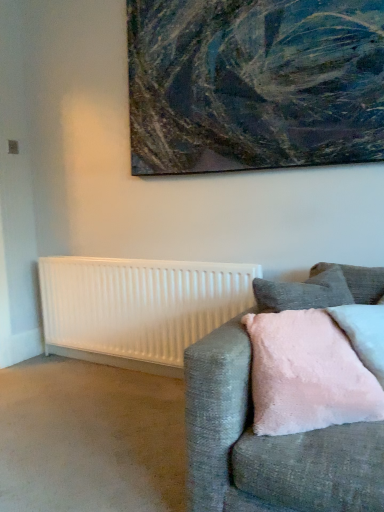
Measure the distance between point (155, 362) and camera.

Point (155, 362) and camera are 2.58 meters apart from each other.

What do you see at coordinates (267, 444) in the screenshot?
I see `textured gray couch at right` at bounding box center [267, 444].

Measure the distance between textured canvas painting at upper center and camera.

They are 5.99 feet apart.

Identify the location of white matte radiator at lower left. (137, 308).

Considering the sizes of pink fluffy pillow at right and white matte radiator at lower left in the image, is pink fluffy pillow at right wider or thinner than white matte radiator at lower left?

Clearly, pink fluffy pillow at right has more width compared to white matte radiator at lower left.

Is pink fluffy pillow at right in front of or behind white matte radiator at lower left in the image?

In the image, pink fluffy pillow at right appears in front of white matte radiator at lower left.

Between pink fluffy pillow at right and white matte radiator at lower left, which one has smaller size?

pink fluffy pillow at right is smaller.

Is pink fluffy pillow at right taller or shorter than white matte radiator at lower left?

pink fluffy pillow at right is shorter than white matte radiator at lower left.

In terms of size, does textured canvas painting at upper center appear bigger or smaller than white matte radiator at lower left?

Clearly, textured canvas painting at upper center is larger in size than white matte radiator at lower left.

From a real-world perspective, between textured canvas painting at upper center and white matte radiator at lower left, who is vertically lower?

white matte radiator at lower left is physically lower.

Which is farther, (153,126) or (159,341)?

The point (159,341) is farther.

Is textured canvas painting at upper center to the left or to the right of white matte radiator at lower left in the image?

From the image, it's evident that textured canvas painting at upper center is to the right of white matte radiator at lower left.

Can you confirm if white matte radiator at lower left is bigger than textured gray couch at right?

No, white matte radiator at lower left is not bigger than textured gray couch at right.

Is white matte radiator at lower left facing away from textured gray couch at right?

That's not correct — white matte radiator at lower left is not looking away from textured gray couch at right.

From a real-world perspective, is white matte radiator at lower left physically above textured gray couch at right?

Incorrect, from a real-world perspective, white matte radiator at lower left is lower than textured gray couch at right.

Who is bigger, pink fluffy pillow at right or textured canvas painting at upper center?

With larger size is textured canvas painting at upper center.

Is pink fluffy pillow at right inside the boundaries of textured canvas painting at upper center, or outside?

pink fluffy pillow at right is not enclosed by textured canvas painting at upper center.

Does pink fluffy pillow at right appear on the left side of textured canvas painting at upper center?

Incorrect, pink fluffy pillow at right is not on the left side of textured canvas painting at upper center.

How different are the orientations of pink fluffy pillow at right and textured canvas painting at upper center in degrees?

21.8 degrees separate the facing orientations of pink fluffy pillow at right and textured canvas painting at upper center.

Considering the relative sizes of pink fluffy pillow at right and textured gray couch at right in the image provided, is pink fluffy pillow at right bigger than textured gray couch at right?

No.

From a real-world perspective, is pink fluffy pillow at right above or below textured gray couch at right?

pink fluffy pillow at right is above textured gray couch at right.

From the image's perspective, which is above, pink fluffy pillow at right or textured gray couch at right?

pink fluffy pillow at right is shown above in the image.

Is white matte radiator at lower left next to textured canvas painting at upper center and touching it?

No, white matte radiator at lower left is not next to textured canvas painting at upper center.

From a real-world perspective, which is physically below, white matte radiator at lower left or textured canvas painting at upper center?

white matte radiator at lower left.

From the image's perspective, is white matte radiator at lower left above textured canvas painting at upper center?

No, from the image's perspective, white matte radiator at lower left is not on top of textured canvas painting at upper center.

Does white matte radiator at lower left lie in front of textured canvas painting at upper center?

That is False.

What's the angular difference between textured canvas painting at upper center and pink fluffy pillow at right's facing directions?

21.8 degrees separate the facing orientations of textured canvas painting at upper center and pink fluffy pillow at right.

Consider the image. Does textured canvas painting at upper center appear on the left side of pink fluffy pillow at right?

Correct, you'll find textured canvas painting at upper center to the left of pink fluffy pillow at right.

Which is behind, textured canvas painting at upper center or pink fluffy pillow at right?

Positioned behind is textured canvas painting at upper center.

This screenshot has width=384, height=512. Find the location of `pillow that is above the white matte radiator at lower left (from the image's perspective)`. pillow that is above the white matte radiator at lower left (from the image's perspective) is located at coordinates (364, 333).

You are a GUI agent. You are given a task and a screenshot of the screen. Output one action in this format:
    pyautogui.click(x=<x>, y=<y>)
    Task: Click on the picture frame in front of the white matte radiator at lower left
    
    Given the screenshot: What is the action you would take?
    pyautogui.click(x=254, y=84)

When comparing their distances from white matte radiator at lower left, does pink fluffy pillow at right or textured gray couch at right seem closer?

textured gray couch at right is positioned closer to the anchor white matte radiator at lower left.

Estimate the real-world distances between objects in this image. Which object is further from white matte radiator at lower left, pink fluffy pillow at right or textured canvas painting at upper center?

pink fluffy pillow at right is positioned further to the anchor white matte radiator at lower left.

Based on their spatial positions, is pink fluffy pillow at right or white matte radiator at lower left closer to textured gray couch at right?

Among the two, pink fluffy pillow at right is located nearer to textured gray couch at right.

When comparing their distances from textured canvas painting at upper center, does white matte radiator at lower left or textured gray couch at right seem further?

textured gray couch at right is positioned further to the anchor textured canvas painting at upper center.

From the image, which object appears to be farther from pink fluffy pillow at right, textured canvas painting at upper center or white matte radiator at lower left?

Among the two, white matte radiator at lower left is located further to pink fluffy pillow at right.

When comparing their distances from white matte radiator at lower left, does textured canvas painting at upper center or pink fluffy pillow at right seem closer?

Among the two, textured canvas painting at upper center is located nearer to white matte radiator at lower left.

Based on their spatial positions, is textured canvas painting at upper center or textured gray couch at right closer to white matte radiator at lower left?

textured canvas painting at upper center is positioned closer to the anchor white matte radiator at lower left.

Looking at the image, which one is located further to textured gray couch at right, pink fluffy pillow at right or textured canvas painting at upper center?

The object further to textured gray couch at right is textured canvas painting at upper center.

This screenshot has width=384, height=512. Identify the location of pillow positioned between textured gray couch at right and white matte radiator at lower left from near to far. (364, 333).

Identify the location of pillow between textured canvas painting at upper center and white matte radiator at lower left in the vertical direction. This screenshot has width=384, height=512. (364, 333).

I want to click on radiator between textured canvas painting at upper center and textured gray couch at right in the up-down direction, so click(x=137, y=308).

Find the location of a particular element. The width and height of the screenshot is (384, 512). pillow between textured canvas painting at upper center and textured gray couch at right vertically is located at coordinates (364, 333).